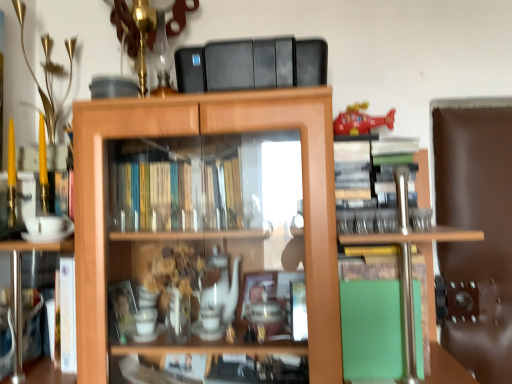
Describe the element at coordinates (371, 316) in the screenshot. I see `green matte book at lower right, positioned as the 1th book in right-to-left order` at that location.

This screenshot has height=384, width=512. What do you see at coordinates (208, 134) in the screenshot?
I see `wooden cabinet at center` at bounding box center [208, 134].

This screenshot has height=384, width=512. What are the coordinates of `wooden cabinet at center` in the screenshot? It's located at (208, 134).

What are the coordinates of `shiny plastic helicopter at upper right` in the screenshot? It's located at (360, 120).

Does green matte book at lower right, acting as the 2th book starting from the left, have a greater width compared to wooden cabinet at center?

No, green matte book at lower right, acting as the 2th book starting from the left, is not wider than wooden cabinet at center.

How different are the orientations of green matte book at lower right, positioned as the 1th book in right-to-left order, and wooden cabinet at center in degrees?

2.42 degrees separate the facing orientations of green matte book at lower right, positioned as the 1th book in right-to-left order, and wooden cabinet at center.

Is wooden cabinet at center at the back of green matte book at lower right, acting as the 2th book starting from the left?

Yes, green matte book at lower right, acting as the 2th book starting from the left,'s orientation is away from wooden cabinet at center.

From the image's perspective, is shiny plastic helicopter at upper right above green matte book at lower left, marked as the 2th book in a right-to-left arrangement?

Yes, from the image's perspective, shiny plastic helicopter at upper right is above green matte book at lower left, marked as the 2th book in a right-to-left arrangement.

Consider the image. Is shiny plastic helicopter at upper right aimed at green matte book at lower left, placed as the first book when sorted from left to right?

No, shiny plastic helicopter at upper right is not facing towards green matte book at lower left, placed as the first book when sorted from left to right.

This screenshot has height=384, width=512. I want to click on toy above the green matte book at lower left, marked as the 2th book in a right-to-left arrangement (from the image's perspective), so click(360, 120).

How much distance is there between shiny plastic helicopter at upper right and green matte book at lower left, marked as the 2th book in a right-to-left arrangement?

shiny plastic helicopter at upper right and green matte book at lower left, marked as the 2th book in a right-to-left arrangement, are 37.87 inches apart.

How different are the orientations of green matte book at lower left, placed as the first book when sorted from left to right, and green matte book at lower right, acting as the 2th book starting from the left, in degrees?

4.81 degrees.

Consider the image. Is green matte book at lower left, marked as the 2th book in a right-to-left arrangement, facing away from green matte book at lower right, acting as the 2th book starting from the left?

No, green matte book at lower left, marked as the 2th book in a right-to-left arrangement, is not facing away from green matte book at lower right, acting as the 2th book starting from the left.

From the picture: Which object is thinner, green matte book at lower left, marked as the 2th book in a right-to-left arrangement, or green matte book at lower right, positioned as the 1th book in right-to-left order?

green matte book at lower left, marked as the 2th book in a right-to-left arrangement.

Is green matte book at lower left, placed as the first book when sorted from left to right, taller or shorter than green matte book at lower right, positioned as the 1th book in right-to-left order?

Considering their sizes, green matte book at lower left, placed as the first book when sorted from left to right, has less height than green matte book at lower right, positioned as the 1th book in right-to-left order.

Can you confirm if wooden cabinet at center is shorter than shiny plastic helicopter at upper right?

No.

Consider the image. Visually, is wooden cabinet at center positioned to the left or to the right of shiny plastic helicopter at upper right?

Clearly, wooden cabinet at center is on the left of shiny plastic helicopter at upper right in the image.

From the shiny plastic helicopter at upper right, count 1st books forward and point to it. Please provide its 2D coordinates.

[(371, 316)]

Which is further, (365,114) or (354,363)?

The point (365,114) is farther.

From their relative heights in the image, would you say shiny plastic helicopter at upper right is taller or shorter than green matte book at lower right, positioned as the 1th book in right-to-left order?

shiny plastic helicopter at upper right is shorter than green matte book at lower right, positioned as the 1th book in right-to-left order.

Does shiny plastic helicopter at upper right have a larger size compared to wooden cabinet at center?

Actually, shiny plastic helicopter at upper right might be smaller than wooden cabinet at center.

Considering the sizes of objects shiny plastic helicopter at upper right and wooden cabinet at center in the image provided, who is shorter, shiny plastic helicopter at upper right or wooden cabinet at center?

Standing shorter between the two is shiny plastic helicopter at upper right.

Relative to wooden cabinet at center, is shiny plastic helicopter at upper right in front or behind?

In the image, shiny plastic helicopter at upper right appears behind wooden cabinet at center.

From the image's perspective, is wooden cabinet at center on top of green matte book at lower right, acting as the 2th book starting from the left?

Yes, from the image's perspective, wooden cabinet at center is over green matte book at lower right, acting as the 2th book starting from the left.

Does point (256, 124) lie behind point (394, 258)?

No, it is not.

Find the location of a particular element. shelf on the left of the green matte book at lower right, positioned as the 1th book in right-to-left order is located at coordinates (208, 134).

Identify the location of book that is the 1st object directly below the wooden cabinet at center (from a real-world perspective). (371, 316).

Where is `book on the left of shiny plastic helicopter at upper right`? The height and width of the screenshot is (384, 512). book on the left of shiny plastic helicopter at upper right is located at coordinates (22, 342).

From the image, which object appears to be farther from green matte book at lower right, positioned as the 1th book in right-to-left order, shiny plastic helicopter at upper right or green matte book at lower left, placed as the first book when sorted from left to right?

green matte book at lower left, placed as the first book when sorted from left to right, lies further to green matte book at lower right, positioned as the 1th book in right-to-left order, than the other object.

Looking at the image, which one is located further to green matte book at lower left, placed as the first book when sorted from left to right, green matte book at lower right, acting as the 2th book starting from the left, or wooden cabinet at center?

The object further to green matte book at lower left, placed as the first book when sorted from left to right, is green matte book at lower right, acting as the 2th book starting from the left.

Based on their spatial positions, is shiny plastic helicopter at upper right or wooden cabinet at center further from green matte book at lower left, placed as the first book when sorted from left to right?

Based on the image, shiny plastic helicopter at upper right appears to be further to green matte book at lower left, placed as the first book when sorted from left to right.

Which object lies further to the anchor point green matte book at lower right, positioned as the 1th book in right-to-left order, green matte book at lower left, placed as the first book when sorted from left to right, or shiny plastic helicopter at upper right?

Among the two, green matte book at lower left, placed as the first book when sorted from left to right, is located further to green matte book at lower right, positioned as the 1th book in right-to-left order.

Estimate the real-world distances between objects in this image. Which object is closer to wooden cabinet at center, green matte book at lower right, positioned as the 1th book in right-to-left order, or green matte book at lower left, marked as the 2th book in a right-to-left arrangement?

green matte book at lower right, positioned as the 1th book in right-to-left order.

Considering their positions, is wooden cabinet at center positioned further to green matte book at lower left, placed as the first book when sorted from left to right, than shiny plastic helicopter at upper right?

Based on the image, shiny plastic helicopter at upper right appears to be further to green matte book at lower left, placed as the first book when sorted from left to right.

In the scene shown: From the image, which object appears to be farther from green matte book at lower right, positioned as the 1th book in right-to-left order, green matte book at lower left, placed as the first book when sorted from left to right, or wooden cabinet at center?

Among the two, green matte book at lower left, placed as the first book when sorted from left to right, is located further to green matte book at lower right, positioned as the 1th book in right-to-left order.

Estimate the real-world distances between objects in this image. Which object is further from green matte book at lower right, acting as the 2th book starting from the left, wooden cabinet at center or shiny plastic helicopter at upper right?

shiny plastic helicopter at upper right is positioned further to the anchor green matte book at lower right, acting as the 2th book starting from the left.

Identify the location of shelf situated between green matte book at lower left, marked as the 2th book in a right-to-left arrangement, and green matte book at lower right, positioned as the 1th book in right-to-left order, from left to right. (208, 134).

At what (x,y) coordinates should I click in order to perform the action: click on toy situated between green matte book at lower left, placed as the first book when sorted from left to right, and green matte book at lower right, positioned as the 1th book in right-to-left order, from left to right. Please return your answer as a coordinate pair (x, y). Image resolution: width=512 pixels, height=384 pixels. Looking at the image, I should click on (360, 120).

Identify the location of shelf between shiny plastic helicopter at upper right and green matte book at lower right, positioned as the 1th book in right-to-left order, vertically. (208, 134).

Where is `shelf between green matte book at lower left, placed as the first book when sorted from left to right, and shiny plastic helicopter at upper right, in the horizontal direction`? This screenshot has height=384, width=512. shelf between green matte book at lower left, placed as the first book when sorted from left to right, and shiny plastic helicopter at upper right, in the horizontal direction is located at coordinates (208, 134).